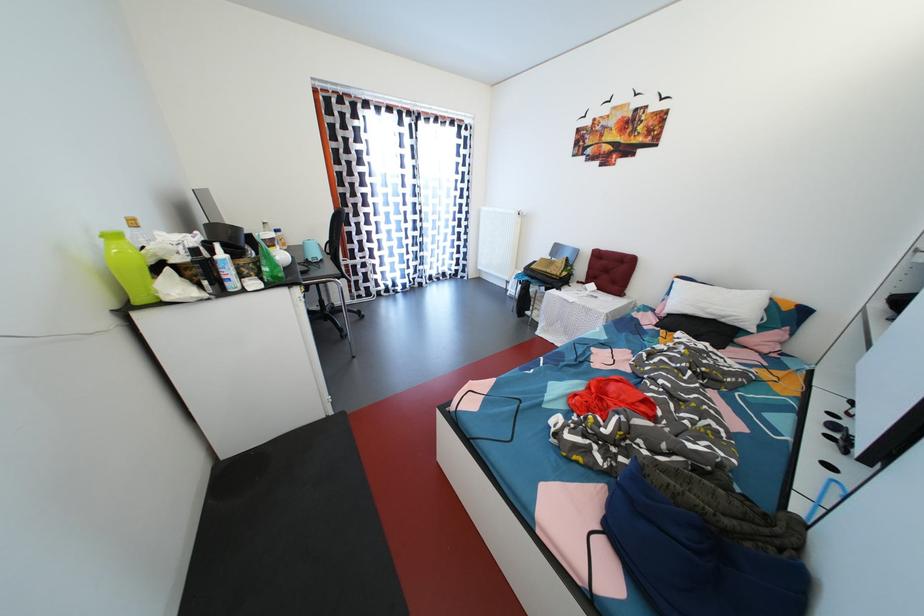
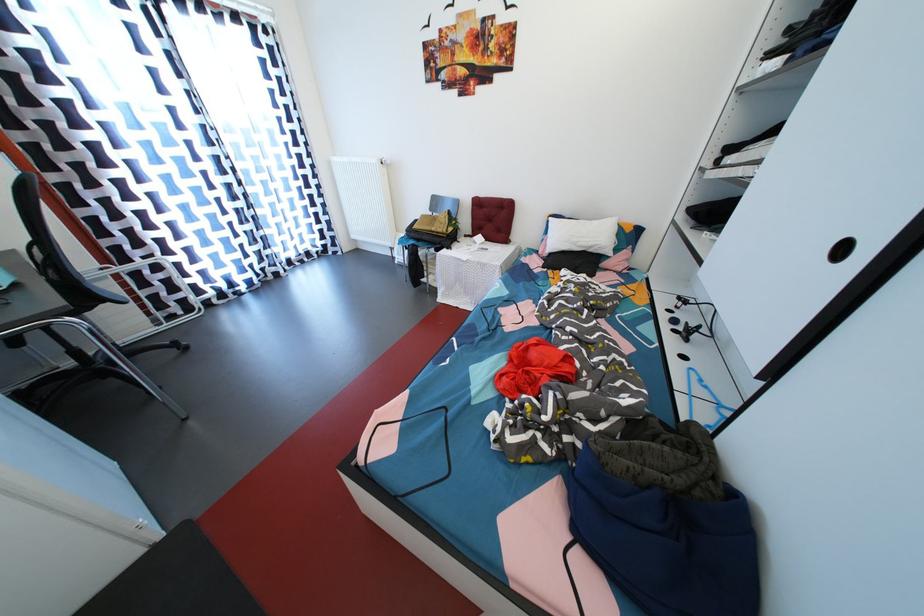
Question: The images are taken continuously from a first-person perspective. In which direction are you moving?

Choices:
 (A) Left
 (B) Right
 (C) Forward
 (D) Backward

Answer: (C)